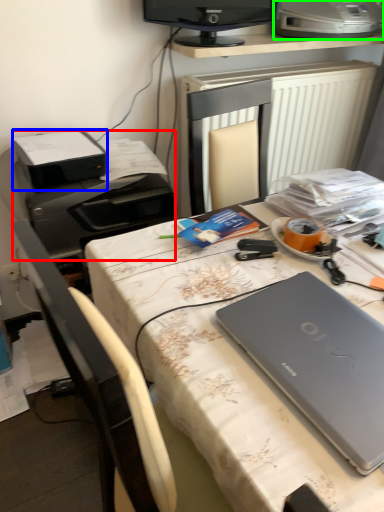
Question: Which is nearer to the printer (highlighted by a red box)? printer (highlighted by a blue box) or printer (highlighted by a green box).

Choices:
 (A) printer
 (B) printer

Answer: (A)